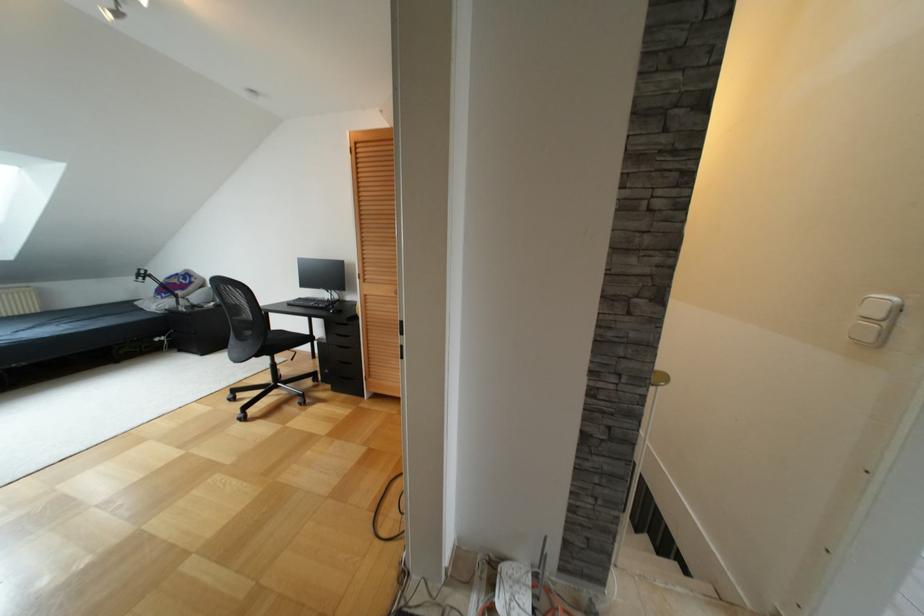
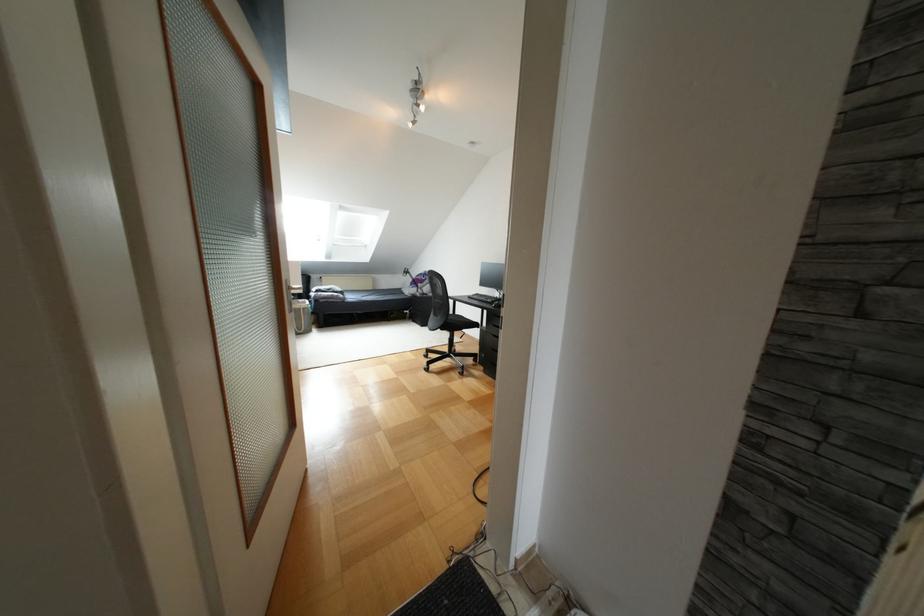
Locate, in the second image, the point that corresponds to (123,306) in the first image.

(396, 290)